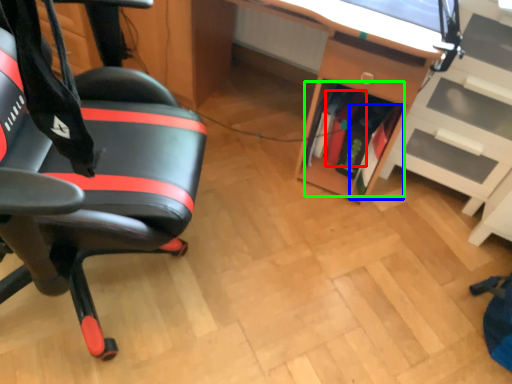
Question: Based on their relative distances, which object is nearer to book (highlighted by a red box)? Choose from book (highlighted by a blue box) and book (highlighted by a green box).

Choices:
 (A) book
 (B) book

Answer: (B)